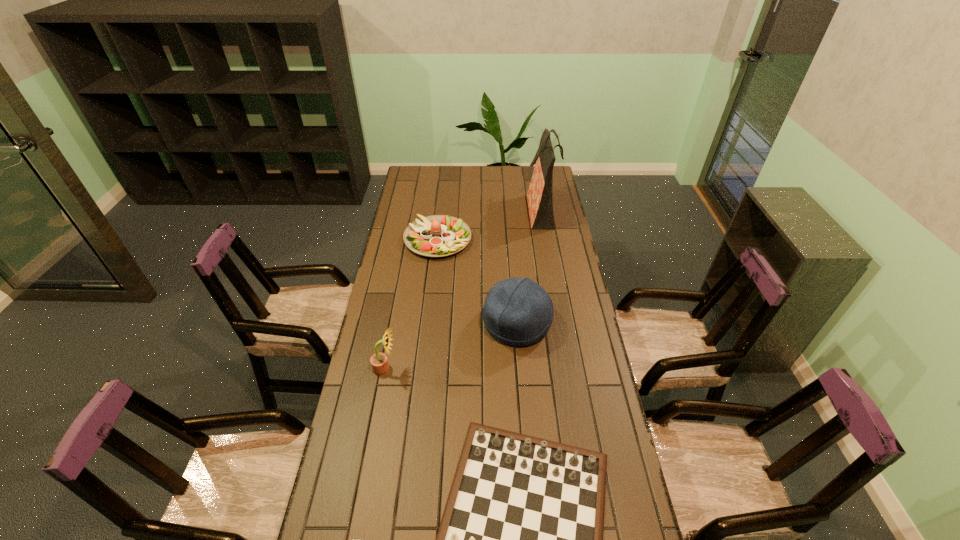
Choose which object is the third nearest neighbor to the salad plate. Please provide its 2D coordinates. Your answer should be formatted as a tuple, i.e. [(x, y)], where the tuple contains the x and y coordinates of a point satisfying the conditions above.

[(379, 362)]

Identify which object is the fourth nearest to the skullcap. Please provide its 2D coordinates. Your answer should be formatted as a tuple, i.e. [(x, y)], where the tuple contains the x and y coordinates of a point satisfying the conditions above.

[(540, 193)]

What are the coordinates of `free point that satisfies the following two spatial constraints: 1. on the front side of the shopping bag; 2. on the front side of the third farthest object` in the screenshot? It's located at (562, 323).

This screenshot has height=540, width=960. What are the coordinates of `free space that satisfies the following two spatial constraints: 1. on the front side of the shopping bag; 2. on the front side of the skullcap` in the screenshot? It's located at (562, 323).